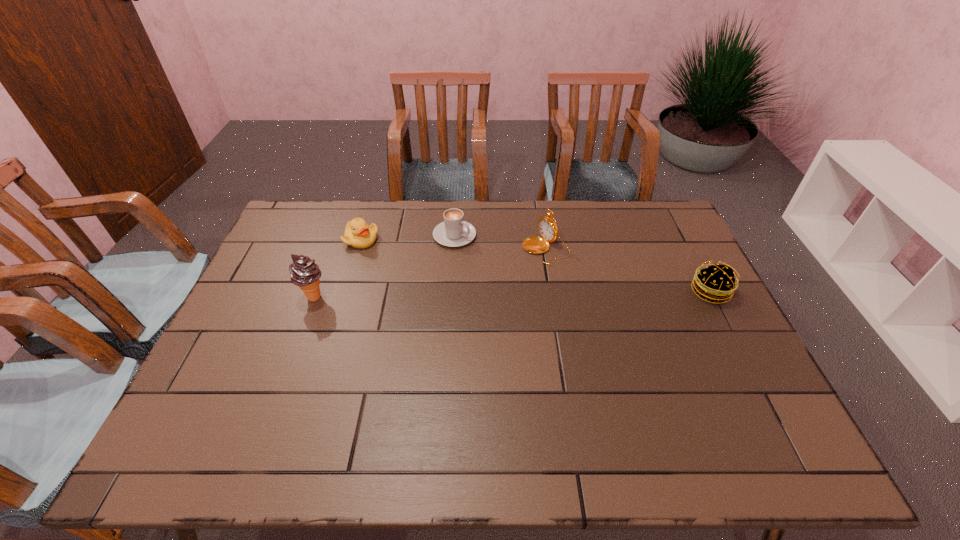
This screenshot has height=540, width=960. I want to click on free region located to the right of the cappuccino, so click(x=487, y=253).

Find the location of `vacant space located 0.340m on the face of the fourth object from left to right`. vacant space located 0.340m on the face of the fourth object from left to right is located at coordinates click(439, 303).

In order to click on free point located 0.350m on the face of the fourth object from left to right in this screenshot , I will do `click(436, 305)`.

This screenshot has height=540, width=960. I want to click on free location located on the face of the fourth object from left to right, so click(420, 313).

You are a GUI agent. You are given a task and a screenshot of the screen. Output one action in this format:
    pyautogui.click(x=<x>, y=<y>)
    Task: Click on the vacant space located 0.230m at the face of the duckling
    The width and height of the screenshot is (960, 540).
    Given the screenshot: What is the action you would take?
    pyautogui.click(x=428, y=272)

The image size is (960, 540). Find the location of `vacant space positioned at the face of the duckling`. vacant space positioned at the face of the duckling is located at coordinates (454, 284).

The width and height of the screenshot is (960, 540). Identify the location of vacant space located at the face of the duckling. (449, 281).

I want to click on cappuccino present at the far edge, so click(454, 231).

This screenshot has height=540, width=960. Find the location of `pocket watch at the far edge`. pocket watch at the far edge is located at coordinates (548, 228).

Image resolution: width=960 pixels, height=540 pixels. In order to click on duckling present at the far edge in this screenshot , I will do `click(358, 234)`.